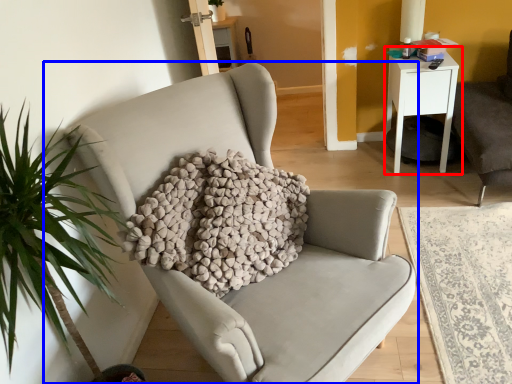
Question: Among these objects, which one is farthest to the camera, nightstand (highlighted by a red box) or chair (highlighted by a blue box)?

Choices:
 (A) nightstand
 (B) chair

Answer: (A)